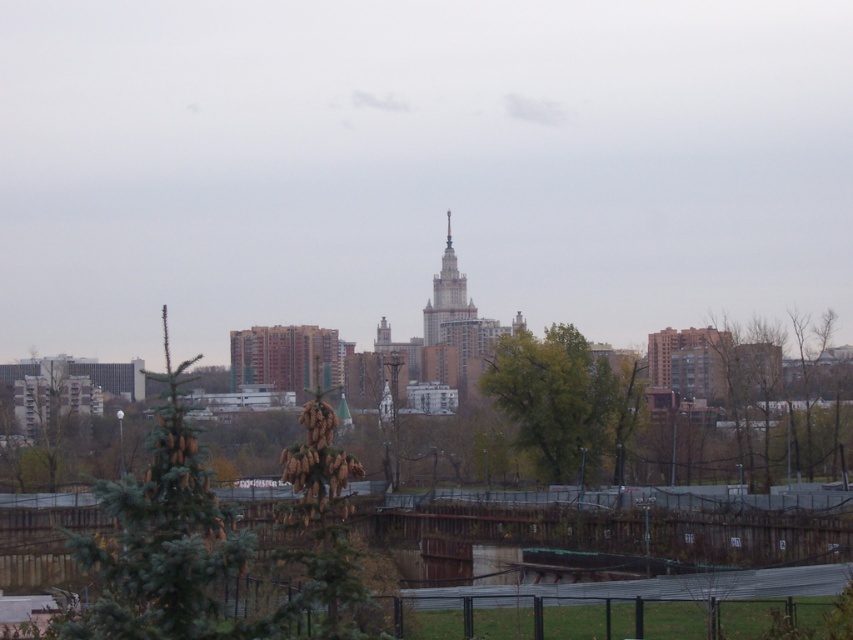
You are a city planner reviewing the urban layout. You notice a point at coordinates (560, 397). Based on the scene description, what significant feature is located at this point?

The point at coordinates (560, 397) indicates a green leafy tree at center.

Based on the scene description, where is the green leafy tree at center located in terms of its 2D coordinates?

The green leafy tree at center is located at the 2D coordinates of point (x=560, y=397).

You are a drone operator trying to capture aerial footage of the cityscape. You have two points marked on your screen, point (538, 360) and point (471, 308). Which point is closer to your camera lens?

Point (538, 360) is closer to the camera lens than point (471, 308).